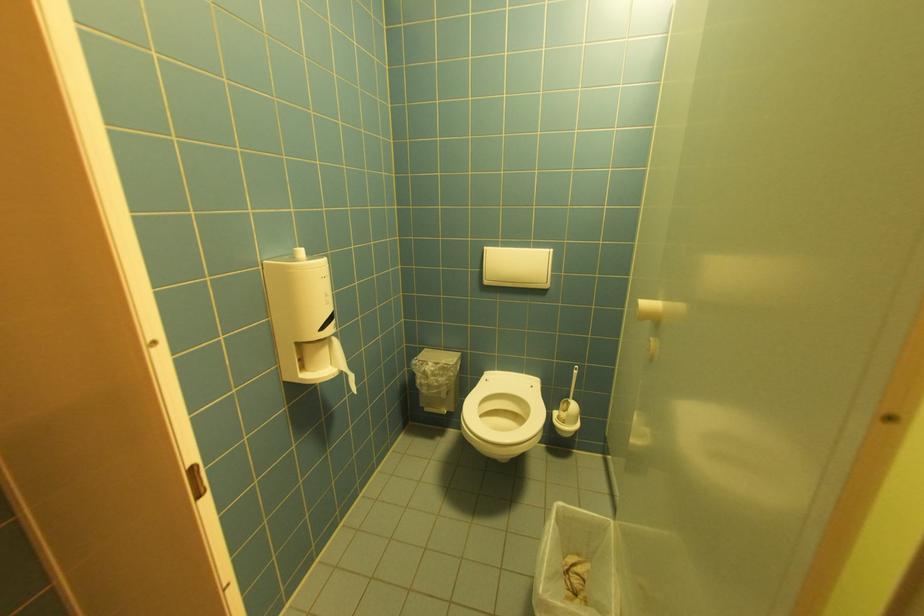
Describe the element at coordinates (517, 267) in the screenshot. I see `the toilet flush button` at that location.